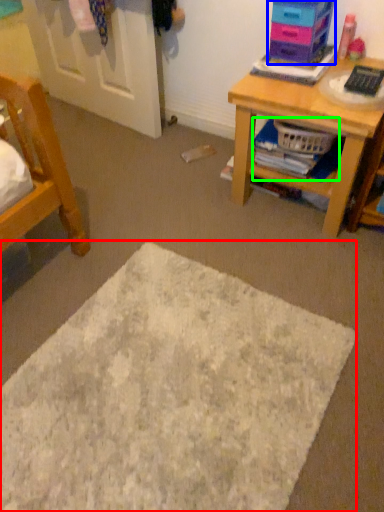
Question: Estimate the real-world distances between objects in this image. Which object is closer to mat (highlighted by a red box), shelf (highlighted by a blue box) or book (highlighted by a green box)?

Choices:
 (A) shelf
 (B) book

Answer: (B)